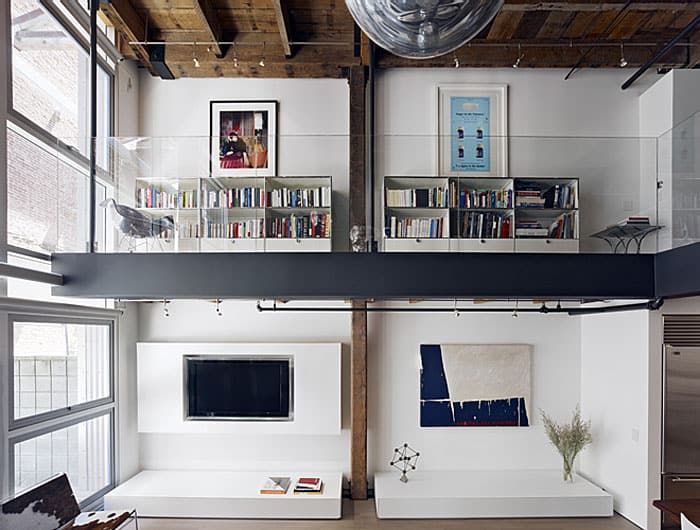
I want to click on plant, so click(x=580, y=432).